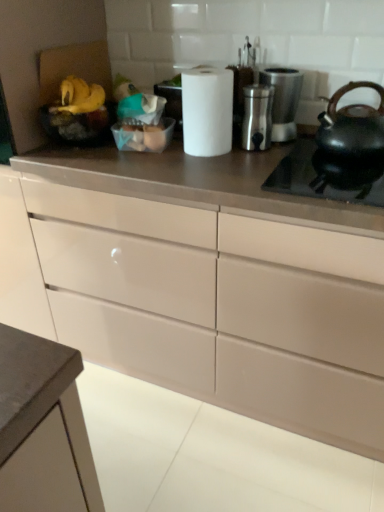
Locate an element on the screen. The image size is (384, 512). free spot in front of satin silver coffee maker at upper right, the 1th appliance from the right is located at coordinates (281, 155).